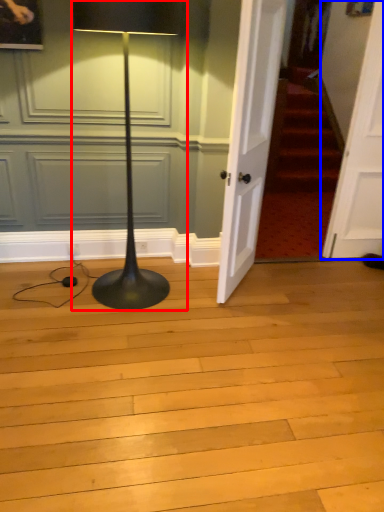
Question: Which object is closer to the camera taking this photo, lamp (highlighted by a red box) or door (highlighted by a blue box)?

Choices:
 (A) lamp
 (B) door

Answer: (A)